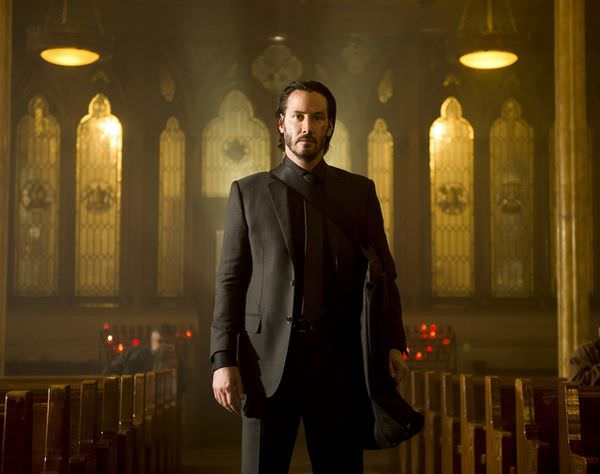
Identify the location of light. This screenshot has width=600, height=474. (70, 58).